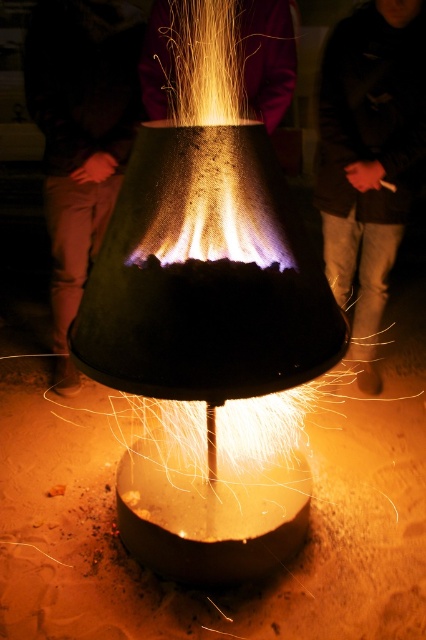
You are standing in the scene and want to place a small decorative stone exactly at the location of the sandy brown sand at bottom center. What coordinates should you aim for?

The sandy brown sand at bottom center is located at coordinates point [221,589], so you should aim for those coordinates.

You are standing in front of the fire pit and see the sandy brown sand at bottom center and the dark brown leather jacket at center. Which object is closer to the ground?

The sandy brown sand at bottom center is located below dark brown leather jacket at center, so it is closer to the ground.